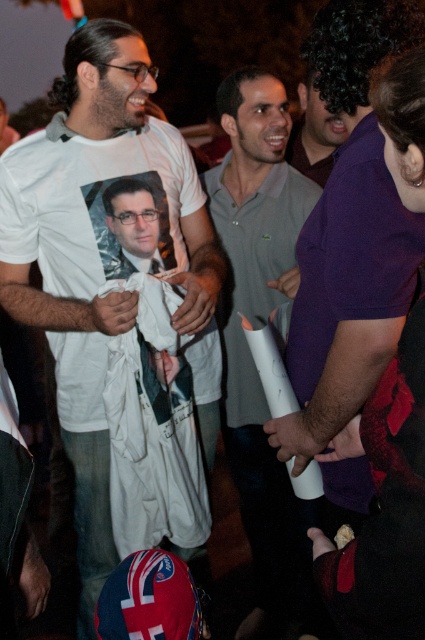
Question: Is white cotton t-shirt at center wider than gray cotton polo shirt at center?

Choices:
 (A) yes
 (B) no

Answer: (A)

Question: Is white cotton t-shirt at center positioned at the back of gray cotton polo shirt at center?

Choices:
 (A) no
 (B) yes

Answer: (A)

Question: Which point is farther to the camera?

Choices:
 (A) gray cotton polo shirt at center
 (B) white cotton t-shirt at center

Answer: (A)

Question: Is white cotton t-shirt at center above gray cotton polo shirt at center?

Choices:
 (A) yes
 (B) no

Answer: (A)

Question: Which point is farther to the camera?

Choices:
 (A) white cotton t-shirt at center
 (B) gray cotton polo shirt at center

Answer: (B)